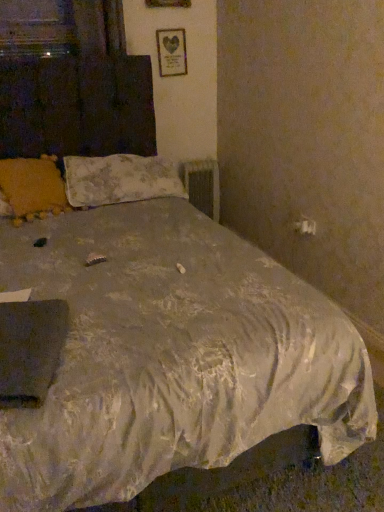
Question: Considering the relative sizes of floral fabric pillow at upper left, arranged as the first pillow when viewed from the right, and metallic silver radiator at center in the image provided, is floral fabric pillow at upper left, arranged as the first pillow when viewed from the right, taller than metallic silver radiator at center?

Choices:
 (A) no
 (B) yes

Answer: (A)

Question: From a real-world perspective, is floral fabric pillow at upper left, arranged as the first pillow when viewed from the right, physically above metallic silver radiator at center?

Choices:
 (A) yes
 (B) no

Answer: (A)

Question: Is floral fabric pillow at upper left, arranged as the first pillow when viewed from the right, closer to camera compared to metallic silver radiator at center?

Choices:
 (A) yes
 (B) no

Answer: (A)

Question: Does floral fabric pillow at upper left, which is the 2th pillow from left to right, contain metallic silver radiator at center?

Choices:
 (A) no
 (B) yes

Answer: (A)

Question: Considering the relative sizes of floral fabric pillow at upper left, which is the 2th pillow from left to right, and metallic silver radiator at center in the image provided, is floral fabric pillow at upper left, which is the 2th pillow from left to right, bigger than metallic silver radiator at center?

Choices:
 (A) no
 (B) yes

Answer: (B)

Question: Is floral fabric pillow at upper left, which is the 2th pillow from left to right, positioned behind metallic silver radiator at center?

Choices:
 (A) no
 (B) yes

Answer: (A)

Question: Is metallic silver radiator at center not near wooden frame with heart print at upper center?

Choices:
 (A) no
 (B) yes

Answer: (A)

Question: Can you confirm if metallic silver radiator at center is shorter than wooden frame with heart print at upper center?

Choices:
 (A) yes
 (B) no

Answer: (B)

Question: Is metallic silver radiator at center not within wooden frame with heart print at upper center?

Choices:
 (A) yes
 (B) no

Answer: (A)

Question: From a real-world perspective, does metallic silver radiator at center stand above wooden frame with heart print at upper center?

Choices:
 (A) yes
 (B) no

Answer: (B)

Question: Is metallic silver radiator at center closer to camera compared to wooden frame with heart print at upper center?

Choices:
 (A) yes
 (B) no

Answer: (B)

Question: Are metallic silver radiator at center and wooden frame with heart print at upper center making contact?

Choices:
 (A) no
 (B) yes

Answer: (A)

Question: Is the depth of yellow fabric pillow at upper left, acting as the second pillow starting from the right, less than that of wooden frame with heart print at upper center?

Choices:
 (A) yes
 (B) no

Answer: (A)